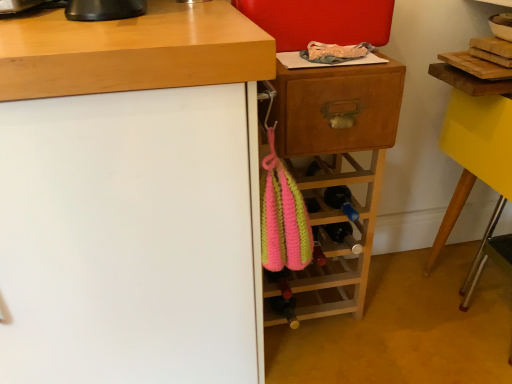
Question: Considering the positions of pink knitted bag at center and yellow glossy table at right in the image, is pink knitted bag at center wider or thinner than yellow glossy table at right?

Choices:
 (A) thin
 (B) wide

Answer: (A)

Question: Is point (337, 284) closer or farther from the camera than point (499, 201)?

Choices:
 (A) farther
 (B) closer

Answer: (B)

Question: Estimate the real-world distances between objects in this image. Which object is closer to the wooden drawer at upper right?

Choices:
 (A) pink knitted bag at center
 (B) pink knitted bottle at center
 (C) yellow glossy table at right
 (D) white matte cabinet at left

Answer: (A)

Question: Considering the real-world distances, which object is closest to the wooden drawer at upper right?

Choices:
 (A) pink knitted bag at center
 (B) yellow glossy table at right
 (C) pink knitted bottle at center
 (D) white matte cabinet at left

Answer: (A)